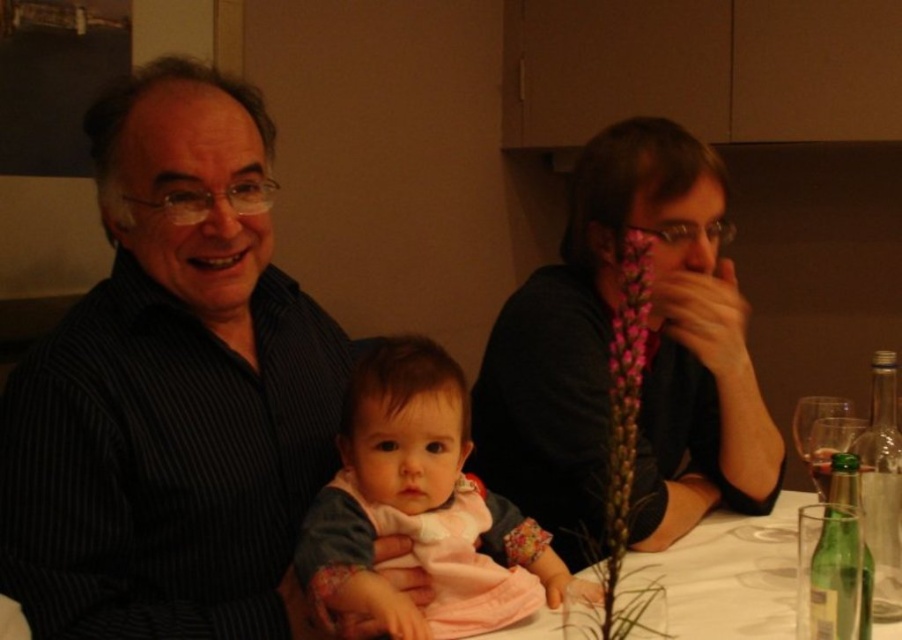
You are a waiter who needs to deliver a dessert to the table. The dessert is placed on a tray in your hand. You must navigate around the dark striped shirt at left and the clear glass wine glass at right to reach the center of the table where the baby is. Can you safely place the dessert without knocking over the wine glass or touching the shirt?

The dark striped shirt at left is 30.30 inches away from the clear glass wine glass at right. Since the distance between them is sufficient, you can safely navigate around both objects to place the dessert in the center without knocking over the wine glass or touching the shirt.

You are a photographer trying to capture a closeup of the dark striped shirt at left and the clear glass wine glass at right. If you want to ensure both items are in focus, which one should you adjust your camera focus on first?

The dark striped shirt at left is wider than the clear glass wine glass at right, so you should focus on the dark striped shirt at left first to ensure both are in focus.